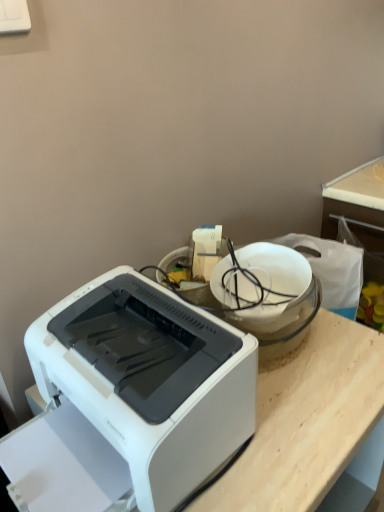
Question: Considering their positions, is white plastic printer at lower left located in front of or behind white glossy bowl at upper center?

Choices:
 (A) behind
 (B) front

Answer: (B)

Question: Is point (190, 404) closer or farther from the camera than point (314, 279)?

Choices:
 (A) farther
 (B) closer

Answer: (B)

Question: From the image's perspective, is white plastic printer at lower left positioned above or below white glossy bowl at upper center?

Choices:
 (A) above
 (B) below

Answer: (B)

Question: In terms of height, does white glossy bowl at upper center look taller or shorter compared to white plastic printer at lower left?

Choices:
 (A) short
 (B) tall

Answer: (A)

Question: Considering the positions of white glossy bowl at upper center and white plastic printer at lower left in the image, is white glossy bowl at upper center bigger or smaller than white plastic printer at lower left?

Choices:
 (A) big
 (B) small

Answer: (B)

Question: From the image's perspective, is white glossy bowl at upper center above or below white plastic printer at lower left?

Choices:
 (A) below
 (B) above

Answer: (B)

Question: Does point (304, 292) appear closer or farther from the camera than point (26, 330)?

Choices:
 (A) closer
 (B) farther

Answer: (B)